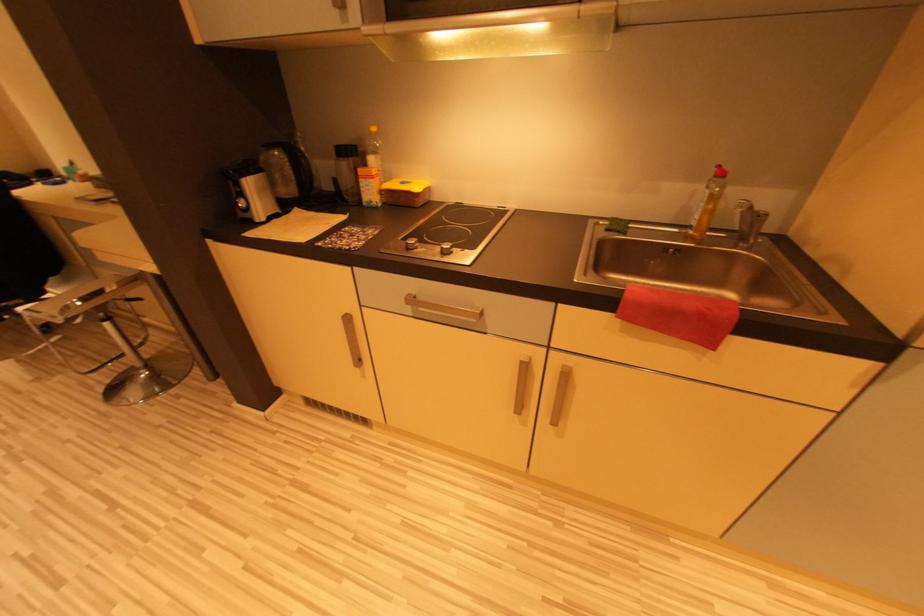
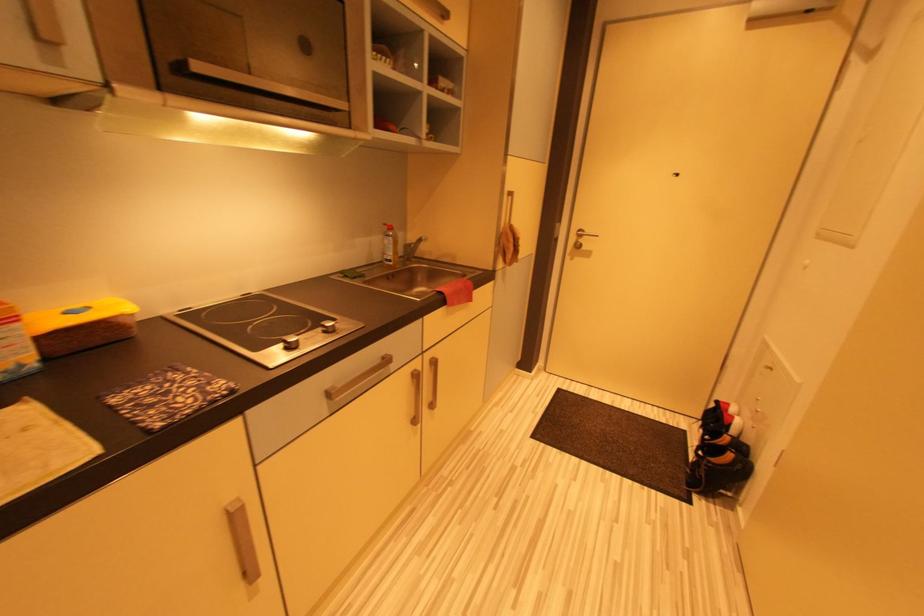
Question: The camera is either moving clockwise (left) or counter-clockwise (right) around the object. The first image is from the beginning of the video and the second image is from the end. Is the camera moving left or right when shooting the video?

Choices:
 (A) Left
 (B) Right

Answer: (A)